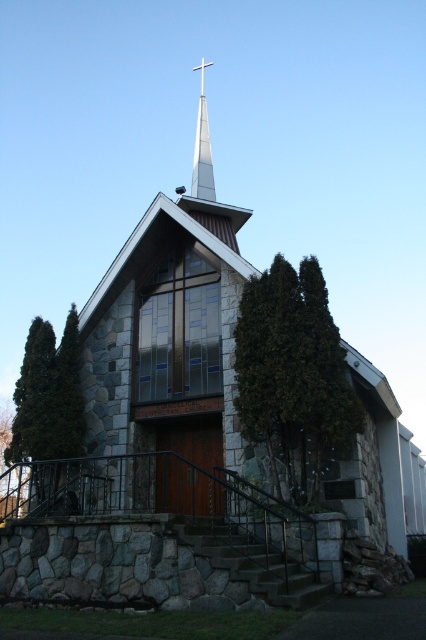
Question: Can you confirm if green textured stone at center is positioned below silver metallic spire at upper center?

Choices:
 (A) no
 (B) yes

Answer: (B)

Question: Can you confirm if green textured stone at center is positioned below metallic cross at upper center?

Choices:
 (A) no
 (B) yes

Answer: (B)

Question: Considering the real-world distances, which object is closest to the metallic cross at upper center?

Choices:
 (A) green textured stone at center
 (B) silver metallic spire at upper center

Answer: (B)

Question: Which of the following is the farthest from the observer?

Choices:
 (A) metallic cross at upper center
 (B) green leafy tree at left
 (C) green textured stone at center
 (D) silver metallic spire at upper center

Answer: (A)

Question: Does green leafy tree at left appear over silver metallic spire at upper center?

Choices:
 (A) no
 (B) yes

Answer: (A)

Question: Which point is farther from the camera taking this photo?

Choices:
 (A) (51, 436)
 (B) (198, 67)
 (C) (201, 109)

Answer: (C)